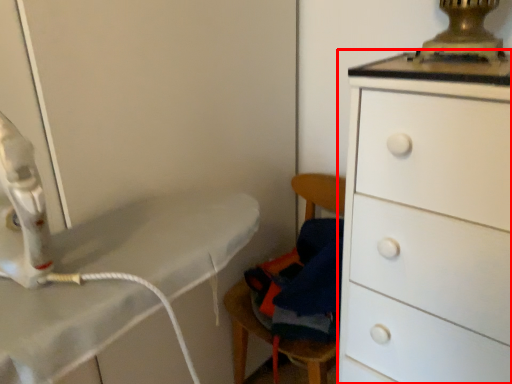
Question: From the image's perspective, considering the relative positions of chest of drawers (annotated by the red box) and swivel chair in the image provided, where is chest of drawers (annotated by the red box) located with respect to the staircase?

Choices:
 (A) below
 (B) above

Answer: (A)